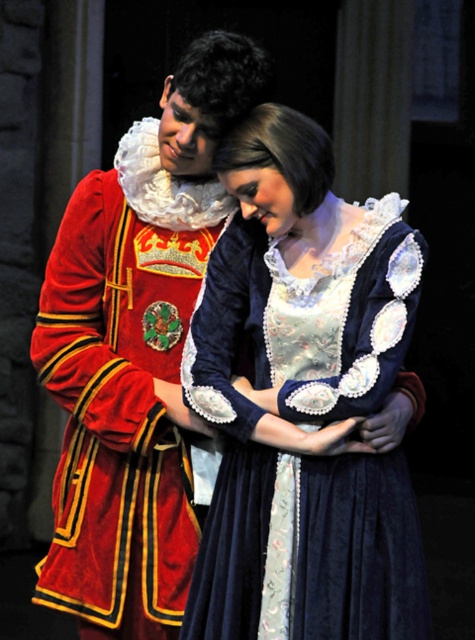
Is velvet dress at center to the left of velvet red coat at center from the viewer's perspective?

In fact, velvet dress at center is to the right of velvet red coat at center.

Is point (189, 358) more distant than point (152, 385)?

No, (189, 358) is in front of (152, 385).

What do you see at coordinates (303, 400) in the screenshot? I see `velvet dress at center` at bounding box center [303, 400].

At what (x,y) coordinates should I click in order to perform the action: click on velvet dress at center. Please return your answer as a coordinate pair (x, y). The height and width of the screenshot is (640, 475). Looking at the image, I should click on (303, 400).